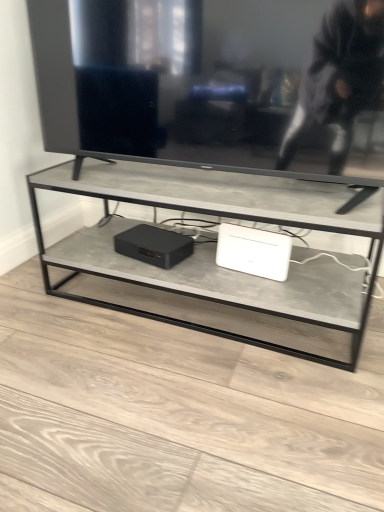
Question: Which direction should I rotate to look at matte black device at center, the first computer positioned from the left, — up or down?

Choices:
 (A) up
 (B) down

Answer: (A)

Question: From the image's perspective, is matte black device at center, the first computer positioned from the left, below white plastic router at center, which ranks as the first computer in right-to-left order?

Choices:
 (A) yes
 (B) no

Answer: (B)

Question: Could you tell me if matte black device at center, which is counted as the 2th computer, starting from the right, is turned towards white plastic router at center, which ranks as the first computer in right-to-left order?

Choices:
 (A) yes
 (B) no

Answer: (B)

Question: Is matte black device at center, the first computer positioned from the left, wider than white plastic router at center, which appears as the second computer when viewed from the left?

Choices:
 (A) yes
 (B) no

Answer: (A)

Question: Is matte black device at center, which is counted as the 2th computer, starting from the right, not close to white plastic router at center, which ranks as the first computer in right-to-left order?

Choices:
 (A) yes
 (B) no

Answer: (B)

Question: Considering the relative positions of matte black device at center, which is counted as the 2th computer, starting from the right, and white plastic router at center, which ranks as the first computer in right-to-left order, in the image provided, is matte black device at center, which is counted as the 2th computer, starting from the right, to the right of white plastic router at center, which ranks as the first computer in right-to-left order, from the viewer's perspective?

Choices:
 (A) no
 (B) yes

Answer: (A)

Question: Is matte black device at center, the first computer positioned from the left, to the left of white plastic router at center, which ranks as the first computer in right-to-left order, from the viewer's perspective?

Choices:
 (A) yes
 (B) no

Answer: (A)

Question: Is the position of white plastic router at center, which appears as the second computer when viewed from the left, more distant than that of matte black device at center, which is counted as the 2th computer, starting from the right?

Choices:
 (A) no
 (B) yes

Answer: (A)

Question: Does white plastic router at center, which ranks as the first computer in right-to-left order, appear on the right side of matte black device at center, the first computer positioned from the left?

Choices:
 (A) no
 (B) yes

Answer: (B)

Question: From a real-world perspective, is white plastic router at center, which ranks as the first computer in right-to-left order, on matte black device at center, which is counted as the 2th computer, starting from the right?

Choices:
 (A) yes
 (B) no

Answer: (A)

Question: Is white plastic router at center, which ranks as the first computer in right-to-left order, in front of matte black device at center, the first computer positioned from the left?

Choices:
 (A) no
 (B) yes

Answer: (B)

Question: Is white plastic router at center, which ranks as the first computer in right-to-left order, thinner than matte black device at center, the first computer positioned from the left?

Choices:
 (A) no
 (B) yes

Answer: (B)

Question: Is white plastic router at center, which appears as the second computer when viewed from the left, smaller than matte black device at center, the first computer positioned from the left?

Choices:
 (A) yes
 (B) no

Answer: (A)

Question: Is matte black device at center, which is counted as the 2th computer, starting from the right, spatially inside white plastic router at center, which ranks as the first computer in right-to-left order, or outside of it?

Choices:
 (A) inside
 (B) outside

Answer: (B)